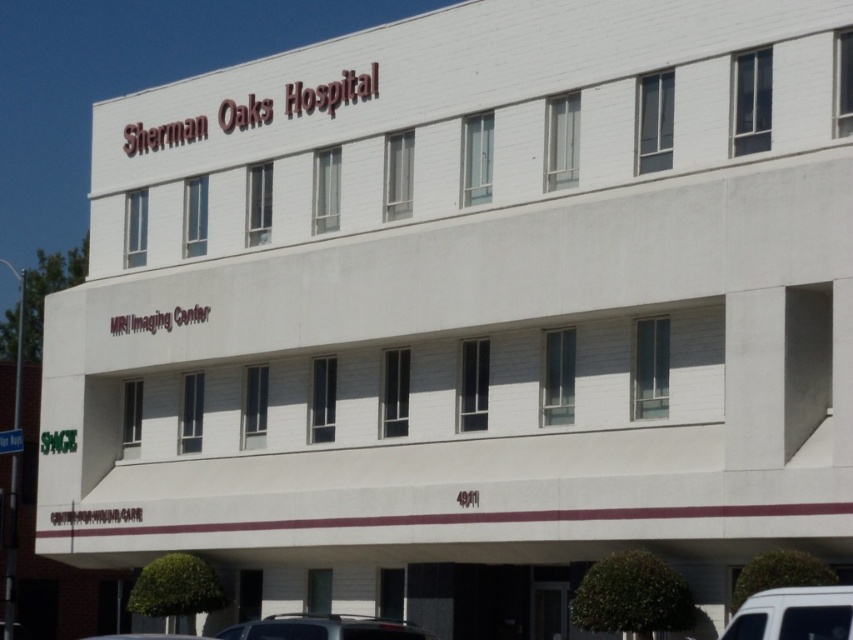
Does white matte van at lower right have a larger size compared to black matte car at lower center?

No.

Can you confirm if white matte van at lower right is thinner than black matte car at lower center?

Indeed, white matte van at lower right has a lesser width compared to black matte car at lower center.

Identify the location of white matte van at lower right. pyautogui.click(x=793, y=614).

Is white matte van at lower right further to the viewer compared to white matte car at lower center?

No.

Between white matte van at lower right and white matte car at lower center, which one is positioned lower?

white matte car at lower center is below.

I want to click on white matte van at lower right, so click(793, 614).

Does black matte car at lower center appear on the right side of white matte car at lower center?

Yes, black matte car at lower center is to the right of white matte car at lower center.

Who is more distant from viewer, (372,621) or (155,634)?

Point (155,634)

This screenshot has height=640, width=853. What are the coordinates of `black matte car at lower center` in the screenshot? It's located at (323, 627).